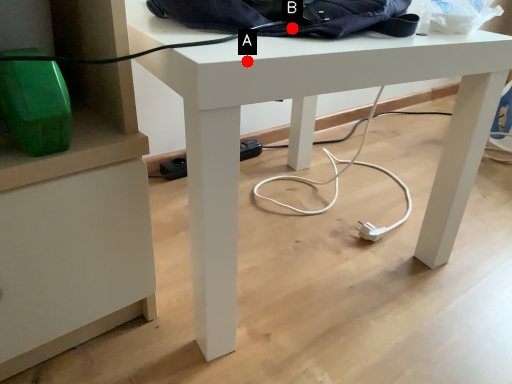
Question: Two points are circled on the image, labeled by A and B beside each circle. Among these points, which one is farthest from the camera?

Choices:
 (A) A is further
 (B) B is further

Answer: (B)